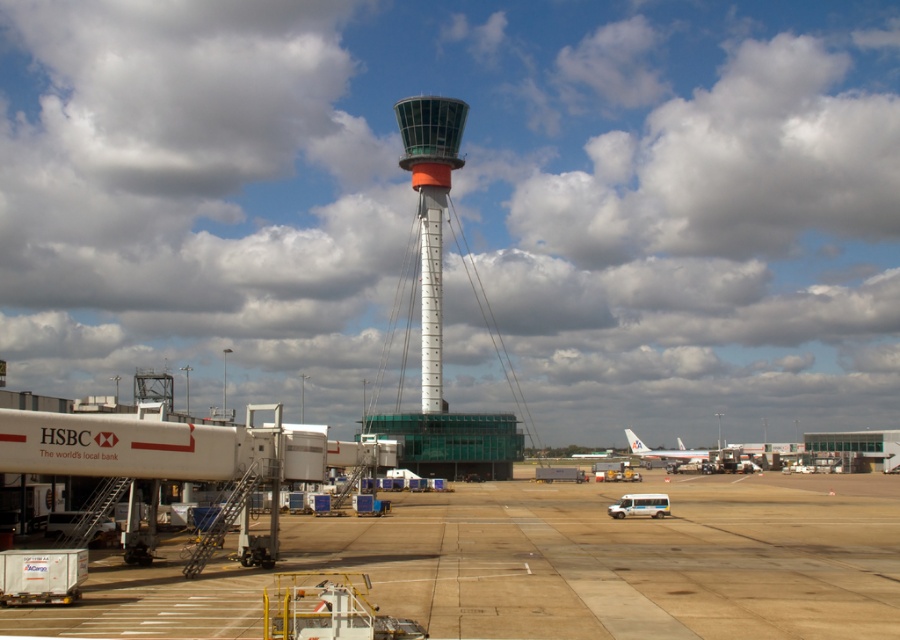
Question: Which object appears farthest from the camera in this image?

Choices:
 (A) brown concrete tarmac at center
 (B) white smooth control tower at center
 (C) white metallic control tower at center

Answer: (B)

Question: Does white metallic control tower at center have a lesser width compared to white matte airplane at lower right?

Choices:
 (A) no
 (B) yes

Answer: (B)

Question: Which object is the farthest from the white matte airplane at lower right?

Choices:
 (A) brown concrete tarmac at center
 (B) white smooth control tower at center
 (C) white metallic control tower at center

Answer: (A)

Question: Does white metallic control tower at center appear under white matte airplane at lower right?

Choices:
 (A) no
 (B) yes

Answer: (A)

Question: Which of the following is the farthest from the observer?

Choices:
 (A) (443, 472)
 (B) (637, 442)
 (C) (412, 145)
 (D) (47, 609)

Answer: (B)

Question: Does white metallic control tower at center come in front of white matte airplane at lower right?

Choices:
 (A) yes
 (B) no

Answer: (A)